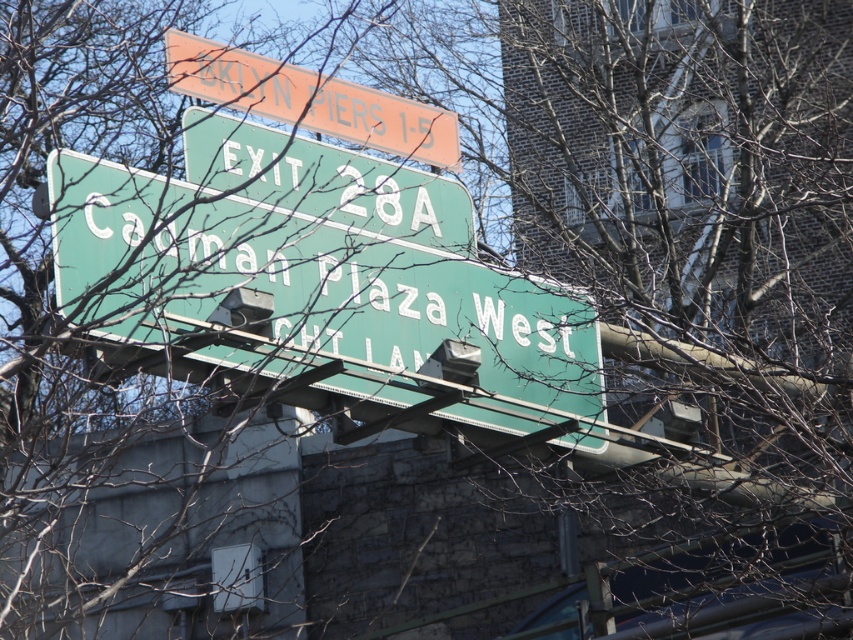
Question: Among these objects, which one is nearest to the camera?

Choices:
 (A) orange plastic sign at upper center
 (B) green metallic sign at center

Answer: (B)

Question: Does green metallic sign at center appear under orange plastic sign at upper center?

Choices:
 (A) no
 (B) yes

Answer: (B)

Question: Is green metallic sign at center to the right of orange plastic sign at upper center from the viewer's perspective?

Choices:
 (A) no
 (B) yes

Answer: (B)

Question: Is the position of green metallic sign at center more distant than that of orange plastic sign at upper center?

Choices:
 (A) yes
 (B) no

Answer: (B)

Question: Which point appears closest to the camera in this image?

Choices:
 (A) (401, 324)
 (B) (432, 136)

Answer: (A)